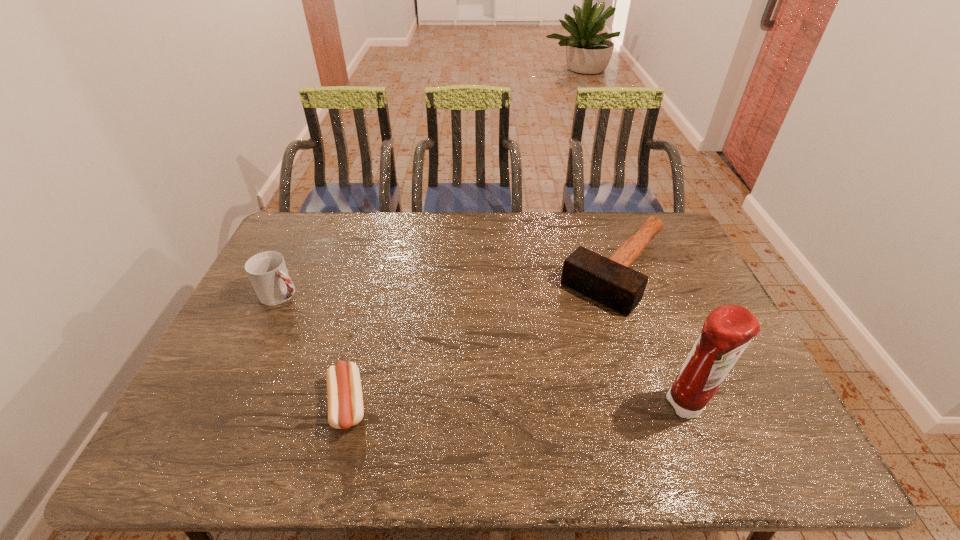
Where is `vacant area in the image that satisfies the following two spatial constraints: 1. on the back side of the leftmost object; 2. on the right side of the mallet`? This screenshot has width=960, height=540. vacant area in the image that satisfies the following two spatial constraints: 1. on the back side of the leftmost object; 2. on the right side of the mallet is located at coordinates (294, 270).

At what (x,y) coordinates should I click in order to perform the action: click on free region that satisfies the following two spatial constraints: 1. on the front side of the shortest object; 2. on the left side of the condiment. Please return your answer as a coordinate pair (x, y). Image resolution: width=960 pixels, height=540 pixels. Looking at the image, I should click on (347, 406).

In order to click on free space that satisfies the following two spatial constraints: 1. on the front side of the shortest object; 2. on the right side of the condiment in this screenshot , I will do `click(347, 406)`.

The image size is (960, 540). I want to click on free location that satisfies the following two spatial constraints: 1. on the front side of the third shortest object; 2. on the left side of the condiment, so click(x=228, y=406).

Locate an element on the screen. This screenshot has width=960, height=540. vacant space that satisfies the following two spatial constraints: 1. on the front side of the shortest object; 2. on the left side of the tallest object is located at coordinates (347, 406).